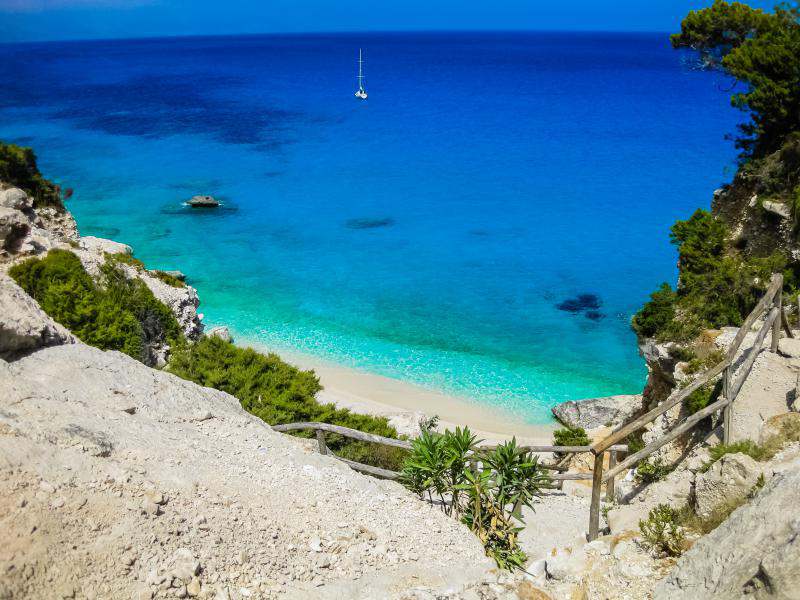
Where is `wood railing`? This screenshot has height=600, width=800. wood railing is located at coordinates (380, 441), (732, 355).